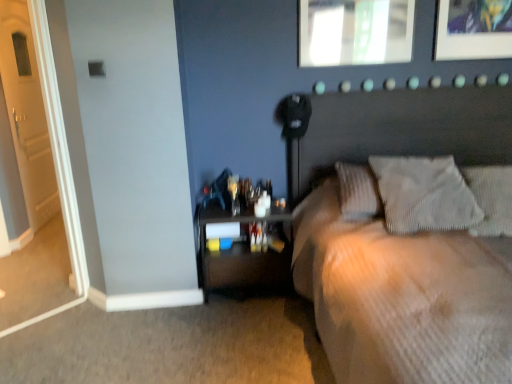
At what (x,y) coordinates should I click in order to perform the action: click on white textured pillow at upper right, which appears as the second pillow when viewed from the right. Please return your answer as a coordinate pair (x, y). Looking at the image, I should click on (424, 194).

What are the coordinates of `beige textured bed at center` in the screenshot? It's located at (402, 241).

Locate an element on the screen. This screenshot has width=512, height=384. white wooden door at left is located at coordinates point(57,161).

Consider the image. Which object is positioned more to the right, textured gray pillow at upper right, the second pillow viewed from the left, or matte glass picture frame at upper center?

From the viewer's perspective, textured gray pillow at upper right, the second pillow viewed from the left, appears more on the right side.

Can you confirm if textured gray pillow at upper right, the second pillow viewed from the left, is bigger than matte glass picture frame at upper center?

Indeed, textured gray pillow at upper right, the second pillow viewed from the left, has a larger size compared to matte glass picture frame at upper center.

From the picture: Between textured gray pillow at upper right, marked as the 1th pillow in a right-to-left arrangement, and matte glass picture frame at upper center, which one has less height?

textured gray pillow at upper right, marked as the 1th pillow in a right-to-left arrangement, is shorter.

Consider the image. What's the angular difference between white textured pillow at upper right, placed as the first pillow when sorted from left to right, and white wooden door at left's facing directions?

47.5 degrees.

Does white textured pillow at upper right, placed as the first pillow when sorted from left to right, appear on the right side of white wooden door at left?

Indeed, white textured pillow at upper right, placed as the first pillow when sorted from left to right, is positioned on the right side of white wooden door at left.

Considering the positions of objects white textured pillow at upper right, placed as the first pillow when sorted from left to right, and white wooden door at left in the image provided, who is behind, white textured pillow at upper right, placed as the first pillow when sorted from left to right, or white wooden door at left?

white textured pillow at upper right, placed as the first pillow when sorted from left to right, is further from the camera.

Which of these two, white textured pillow at upper right, which appears as the second pillow when viewed from the right, or white wooden door at left, stands taller?

white wooden door at left is taller.

Is textured gray pillow at upper right, the second pillow viewed from the left, a part of white wooden door at left?

No, textured gray pillow at upper right, the second pillow viewed from the left, is not a part of white wooden door at left.

Which of these two, white wooden door at left or textured gray pillow at upper right, marked as the 1th pillow in a right-to-left arrangement, is thinner?

With smaller width is white wooden door at left.

Relative to textured gray pillow at upper right, marked as the 1th pillow in a right-to-left arrangement, is white wooden door at left in front or behind?

Clearly, white wooden door at left is in front of textured gray pillow at upper right, marked as the 1th pillow in a right-to-left arrangement.

Consider the image. Between white wooden door at left and textured gray pillow at upper right, marked as the 1th pillow in a right-to-left arrangement, which one has smaller size?

textured gray pillow at upper right, marked as the 1th pillow in a right-to-left arrangement.

Does point (261, 270) lie behind point (477, 169)?

That is True.

From a real-world perspective, who is located higher, wooden nightstand at lower left or textured gray pillow at upper right, marked as the 1th pillow in a right-to-left arrangement?

From a 3D spatial view, textured gray pillow at upper right, marked as the 1th pillow in a right-to-left arrangement, is above.

Where is `nightstand that is on the left side of textured gray pillow at upper right, the second pillow viewed from the left`? Image resolution: width=512 pixels, height=384 pixels. nightstand that is on the left side of textured gray pillow at upper right, the second pillow viewed from the left is located at coordinates (245, 257).

How far apart are wooden nightstand at lower left and textured gray pillow at upper right, marked as the 1th pillow in a right-to-left arrangement?

3.94 feet.

Which of these two, wooden nightstand at lower left or beige textured bed at center, is thinner?

wooden nightstand at lower left.

Which object is further away from the camera, wooden nightstand at lower left or beige textured bed at center?

wooden nightstand at lower left is more distant.

Considering the relative sizes of wooden nightstand at lower left and beige textured bed at center in the image provided, is wooden nightstand at lower left smaller than beige textured bed at center?

Yes, wooden nightstand at lower left is smaller than beige textured bed at center.

Which of these two, wooden nightstand at lower left or beige textured bed at center, stands taller?

beige textured bed at center is taller.

Locate an element on the screen. The image size is (512, 384). picture frame that appears behind the wooden nightstand at lower left is located at coordinates (355, 32).

Is wooden nightstand at lower left far away from matte glass picture frame at upper center?

wooden nightstand at lower left is positioned a significant distance from matte glass picture frame at upper center.

From a real-world perspective, is wooden nightstand at lower left physically located above or below matte glass picture frame at upper center?

From a real-world perspective, wooden nightstand at lower left is physically below matte glass picture frame at upper center.

Considering the sizes of white wooden door at left and beige textured bed at center in the image, is white wooden door at left bigger or smaller than beige textured bed at center?

white wooden door at left is smaller than beige textured bed at center.

Is white wooden door at left placed right next to beige textured bed at center?

No, white wooden door at left is not with beige textured bed at center.

Which of these two, white wooden door at left or beige textured bed at center, is wider?

beige textured bed at center.

Does white wooden door at left contain beige textured bed at center?

No, white wooden door at left does not contain beige textured bed at center.

The height and width of the screenshot is (384, 512). Find the location of `pillow that is the 2nd object located in front of the matte glass picture frame at upper center`. pillow that is the 2nd object located in front of the matte glass picture frame at upper center is located at coordinates (490, 198).

Find the location of a particular element. Image resolution: width=512 pixels, height=384 pixels. door above the white textured pillow at upper right, placed as the first pillow when sorted from left to right (from a real-world perspective) is located at coordinates (57, 161).

Which object lies further to the anchor point white textured pillow at upper right, which appears as the second pillow when viewed from the right, textured gray pillow at upper right, marked as the 1th pillow in a right-to-left arrangement, or white wooden door at left?

white wooden door at left is positioned further to the anchor white textured pillow at upper right, which appears as the second pillow when viewed from the right.

Which object lies further to the anchor point white wooden door at left, matte glass picture frame at upper center or textured gray pillow at upper right, marked as the 1th pillow in a right-to-left arrangement?

textured gray pillow at upper right, marked as the 1th pillow in a right-to-left arrangement.

Based on the photo, from the image, which object appears to be nearer to white wooden door at left, white textured pillow at upper right, which appears as the second pillow when viewed from the right, or matte glass picture frame at upper center?

matte glass picture frame at upper center lies closer to white wooden door at left than the other object.

When comparing their distances from white textured pillow at upper right, placed as the first pillow when sorted from left to right, does wooden nightstand at lower left or textured gray pillow at upper right, the second pillow viewed from the left, seem closer?

Based on the image, textured gray pillow at upper right, the second pillow viewed from the left, appears to be nearer to white textured pillow at upper right, placed as the first pillow when sorted from left to right.

Which object lies further to the anchor point wooden nightstand at lower left, white textured pillow at upper right, placed as the first pillow when sorted from left to right, or beige textured bed at center?

Among the two, white textured pillow at upper right, placed as the first pillow when sorted from left to right, is located further to wooden nightstand at lower left.

From the image, which object appears to be farther from textured gray pillow at upper right, the second pillow viewed from the left, beige textured bed at center or matte glass picture frame at upper center?

Among the two, matte glass picture frame at upper center is located further to textured gray pillow at upper right, the second pillow viewed from the left.

Based on their spatial positions, is white wooden door at left or beige textured bed at center closer to matte glass picture frame at upper center?

beige textured bed at center is closer to matte glass picture frame at upper center.

When comparing their distances from white wooden door at left, does beige textured bed at center or matte glass picture frame at upper center seem closer?

matte glass picture frame at upper center is positioned closer to the anchor white wooden door at left.

In order to click on pillow between matte glass picture frame at upper center and textured gray pillow at upper right, marked as the 1th pillow in a right-to-left arrangement, vertically in this screenshot , I will do `click(424, 194)`.

Locate an element on the screen. The height and width of the screenshot is (384, 512). bed between white wooden door at left and textured gray pillow at upper right, the second pillow viewed from the left, in the horizontal direction is located at coordinates (402, 241).

Identify the location of pillow between wooden nightstand at lower left and textured gray pillow at upper right, the second pillow viewed from the left. coord(424,194).

Where is `picture frame located between white wooden door at left and textured gray pillow at upper right, the second pillow viewed from the left, in the left-right direction`? This screenshot has width=512, height=384. picture frame located between white wooden door at left and textured gray pillow at upper right, the second pillow viewed from the left, in the left-right direction is located at coordinates (355, 32).